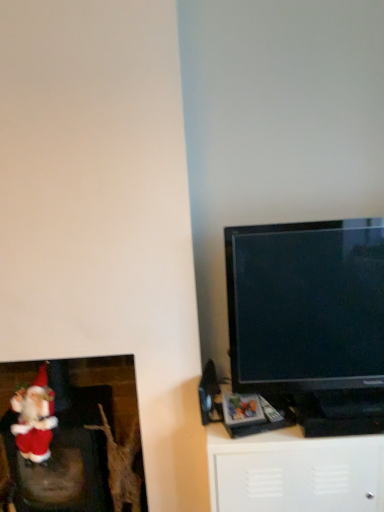
Question: Considering the relative positions of white matte cabinet at lower right and black glossy tv at right in the image provided, is white matte cabinet at lower right in front of black glossy tv at right?

Choices:
 (A) yes
 (B) no

Answer: (B)

Question: Is white matte cabinet at lower right wider than black glossy tv at right?

Choices:
 (A) no
 (B) yes

Answer: (B)

Question: Is white matte cabinet at lower right located outside black glossy tv at right?

Choices:
 (A) yes
 (B) no

Answer: (A)

Question: Considering the relative sizes of white matte cabinet at lower right and black glossy tv at right in the image provided, is white matte cabinet at lower right shorter than black glossy tv at right?

Choices:
 (A) no
 (B) yes

Answer: (B)

Question: From the image's perspective, is white matte cabinet at lower right below black glossy tv at right?

Choices:
 (A) yes
 (B) no

Answer: (A)

Question: In terms of size, does red plush santa at lower left appear bigger or smaller than fuzzy fabric santa at lower left?

Choices:
 (A) big
 (B) small

Answer: (A)

Question: Considering the positions of red plush santa at lower left and fuzzy fabric santa at lower left in the image, is red plush santa at lower left wider or thinner than fuzzy fabric santa at lower left?

Choices:
 (A) thin
 (B) wide

Answer: (B)

Question: From the image's perspective, is red plush santa at lower left located above or below fuzzy fabric santa at lower left?

Choices:
 (A) above
 (B) below

Answer: (B)

Question: Is red plush santa at lower left taller or shorter than fuzzy fabric santa at lower left?

Choices:
 (A) short
 (B) tall

Answer: (B)

Question: Based on their positions, is black glossy tv at right located to the left or right of fuzzy fabric santa at lower left?

Choices:
 (A) left
 (B) right

Answer: (B)

Question: Is black glossy tv at right taller or shorter than fuzzy fabric santa at lower left?

Choices:
 (A) tall
 (B) short

Answer: (A)

Question: Is black glossy tv at right inside the boundaries of fuzzy fabric santa at lower left, or outside?

Choices:
 (A) inside
 (B) outside

Answer: (B)

Question: In terms of width, does black glossy tv at right look wider or thinner when compared to fuzzy fabric santa at lower left?

Choices:
 (A) wide
 (B) thin

Answer: (B)

Question: Looking at their shapes, would you say red plush santa at lower left is wider or thinner than white matte cabinet at lower right?

Choices:
 (A) thin
 (B) wide

Answer: (A)

Question: Visually, is red plush santa at lower left positioned to the left or to the right of white matte cabinet at lower right?

Choices:
 (A) left
 (B) right

Answer: (A)